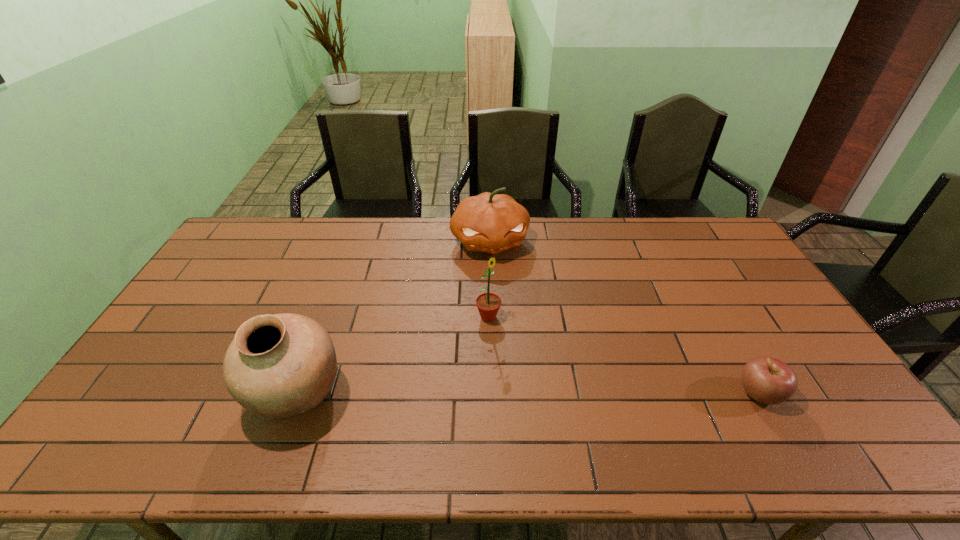
You are a GUI agent. You are given a task and a screenshot of the screen. Output one action in this format:
    pyautogui.click(x=<x>, y=<y>)
    Task: Click on the free spot on the desktop that is between the pottery and the shortest object and is positioned on the face of the sunflower
    
    Given the screenshot: What is the action you would take?
    pyautogui.click(x=583, y=393)

Identify the location of vacant space on the desktop that is between the leftmost object and the rightmost object and is positioned on the front face of the farthest object. (531, 393).